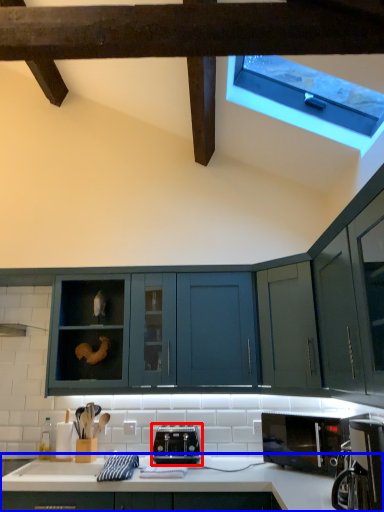
Question: Which point is closer to the camera, toaster (highlighted by a red box) or countertop (highlighted by a blue box)?

Choices:
 (A) toaster
 (B) countertop

Answer: (B)